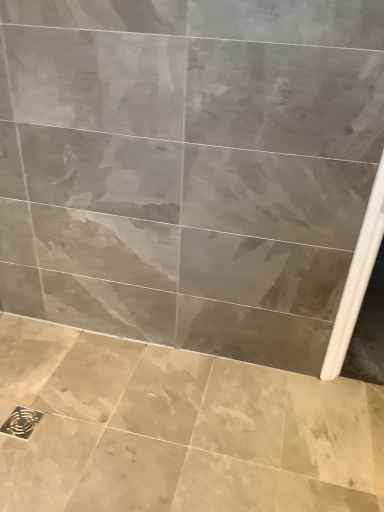
What is the approximate width of brushed metal drain at lower left?

brushed metal drain at lower left is 4.56 inches in width.

Describe the element at coordinates (21, 422) in the screenshot. I see `brushed metal drain at lower left` at that location.

Where is `brushed metal drain at lower left`? The height and width of the screenshot is (512, 384). brushed metal drain at lower left is located at coordinates click(21, 422).

What is the approximate height of brushed metal drain at lower left?

brushed metal drain at lower left is 1.27 centimeters in height.

This screenshot has width=384, height=512. What are the coordinates of `brushed metal drain at lower left` in the screenshot? It's located at (21, 422).